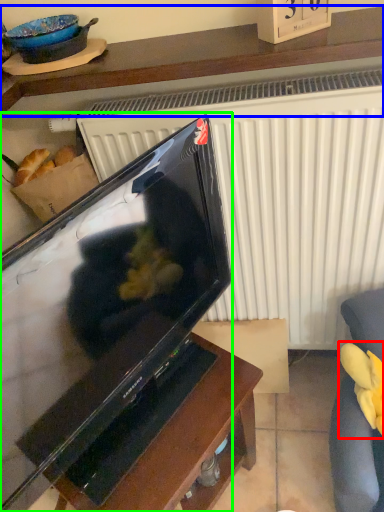
Question: Considering the real-world distances, which object is closest to food (highlighted by a red box)? furniture (highlighted by a blue box) or television (highlighted by a green box).

Choices:
 (A) furniture
 (B) television

Answer: (B)